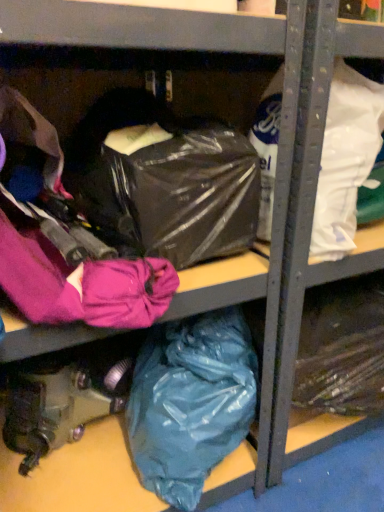
Question: Is teal matte plastic bag at lower center, which is counted as the first plastic bag, starting from the bottom, positioned beyond the bounds of white matte plastic bag at upper right, which ranks as the 2th plastic bag in bottom-to-top order?

Choices:
 (A) no
 (B) yes

Answer: (B)

Question: From a real-world perspective, is teal matte plastic bag at lower center, the 2th plastic bag from the top, over white matte plastic bag at upper right, the first plastic bag in the top-to-bottom sequence?

Choices:
 (A) no
 (B) yes

Answer: (A)

Question: Is teal matte plastic bag at lower center, which is counted as the first plastic bag, starting from the bottom, positioned behind white matte plastic bag at upper right, which ranks as the 2th plastic bag in bottom-to-top order?

Choices:
 (A) no
 (B) yes

Answer: (B)

Question: From the image's perspective, is teal matte plastic bag at lower center, the 2th plastic bag from the top, under white matte plastic bag at upper right, which ranks as the 2th plastic bag in bottom-to-top order?

Choices:
 (A) yes
 (B) no

Answer: (A)

Question: Is teal matte plastic bag at lower center, which is counted as the first plastic bag, starting from the bottom, to the left of white matte plastic bag at upper right, which ranks as the 2th plastic bag in bottom-to-top order, from the viewer's perspective?

Choices:
 (A) yes
 (B) no

Answer: (A)

Question: Looking at the image, does teal matte plastic bag at lower center, the 2th plastic bag from the top, seem bigger or smaller compared to white matte plastic bag at upper right, the first plastic bag in the top-to-bottom sequence?

Choices:
 (A) big
 (B) small

Answer: (A)

Question: From a real-world perspective, is teal matte plastic bag at lower center, which is counted as the first plastic bag, starting from the bottom, positioned above or below white matte plastic bag at upper right, which ranks as the 2th plastic bag in bottom-to-top order?

Choices:
 (A) below
 (B) above

Answer: (A)

Question: Relative to white matte plastic bag at upper right, the first plastic bag in the top-to-bottom sequence, is teal matte plastic bag at lower center, which is counted as the first plastic bag, starting from the bottom, in front or behind?

Choices:
 (A) front
 (B) behind

Answer: (B)

Question: Considering the positions of teal matte plastic bag at lower center, the 2th plastic bag from the top, and white matte plastic bag at upper right, which ranks as the 2th plastic bag in bottom-to-top order, in the image, is teal matte plastic bag at lower center, the 2th plastic bag from the top, wider or thinner than white matte plastic bag at upper right, which ranks as the 2th plastic bag in bottom-to-top order,?

Choices:
 (A) wide
 (B) thin

Answer: (B)

Question: Considering the positions of white matte plastic bag at upper right, which ranks as the 2th plastic bag in bottom-to-top order, and transparent plastic bag at center in the image, is white matte plastic bag at upper right, which ranks as the 2th plastic bag in bottom-to-top order, wider or thinner than transparent plastic bag at center?

Choices:
 (A) thin
 (B) wide

Answer: (A)

Question: Considering the positions of point (370, 150) and point (220, 178), is point (370, 150) closer or farther from the camera than point (220, 178)?

Choices:
 (A) farther
 (B) closer

Answer: (A)

Question: Do you think white matte plastic bag at upper right, the first plastic bag in the top-to-bottom sequence, is within transparent plastic bag at center, or outside of it?

Choices:
 (A) inside
 (B) outside

Answer: (B)

Question: Is white matte plastic bag at upper right, which ranks as the 2th plastic bag in bottom-to-top order, in front of or behind transparent plastic bag at center in the image?

Choices:
 (A) front
 (B) behind

Answer: (B)

Question: Based on their positions, is transparent plastic bag at center located to the left or right of teal matte plastic bag at lower center, which is counted as the first plastic bag, starting from the bottom?

Choices:
 (A) left
 (B) right

Answer: (A)

Question: Looking at their shapes, would you say transparent plastic bag at center is wider or thinner than teal matte plastic bag at lower center, which is counted as the first plastic bag, starting from the bottom?

Choices:
 (A) thin
 (B) wide

Answer: (B)